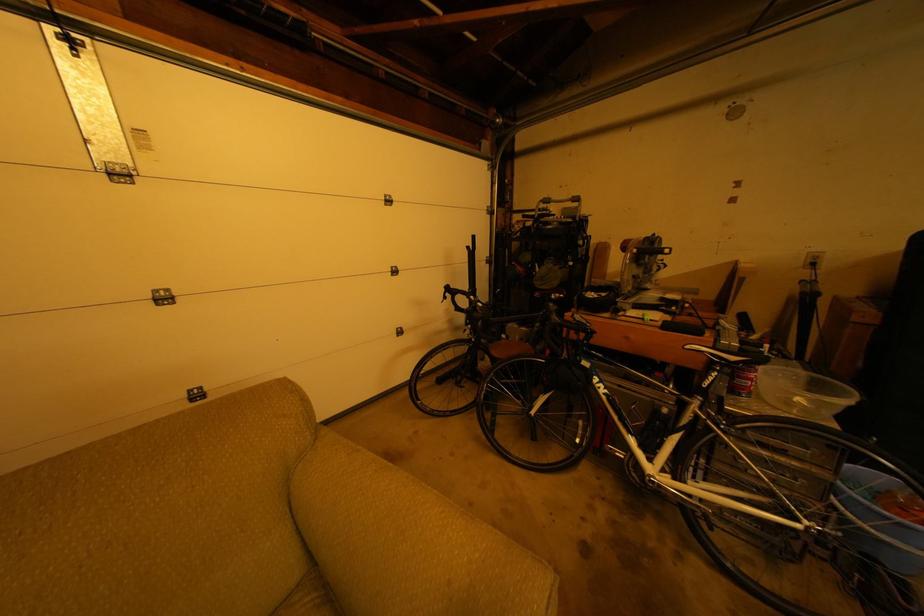
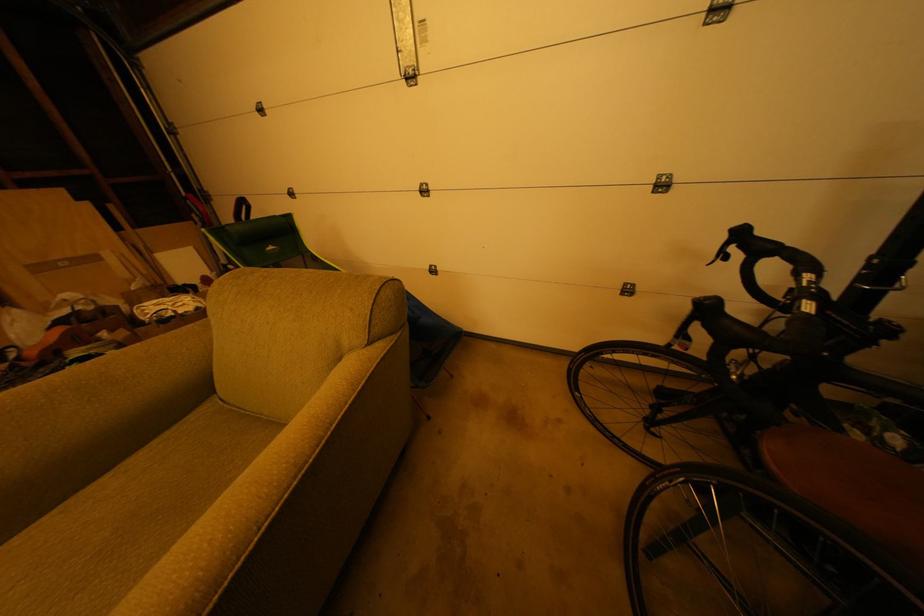
How did the camera likely rotate?

The camera rotated toward left-down.